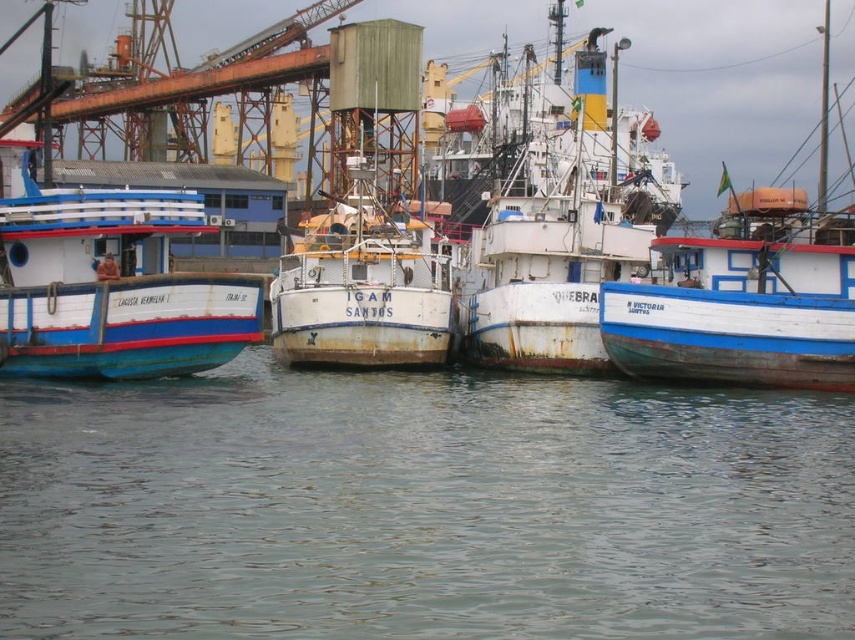
From the picture: Does clear water at center appear under blue painted wooden boat at left?

Yes.

Is clear water at center closer to the viewer compared to blue painted wooden boat at left?

Yes, clear water at center is in front of blue painted wooden boat at left.

Between point (777, 616) and point (109, 276), which one is positioned in front?

Point (777, 616)

Locate an element on the screen. This screenshot has width=855, height=640. clear water at center is located at coordinates (422, 508).

Does white weathered ship at center appear on the left side of blue painted wooden boat at left?

No, white weathered ship at center is not to the left of blue painted wooden boat at left.

Find the location of a particular element. Image resolution: width=855 pixels, height=640 pixels. white weathered ship at center is located at coordinates (565, 230).

Which is below, clear water at center or white weathered ship at center?

clear water at center is below.

Does clear water at center have a lesser height compared to white weathered ship at center?

Yes, clear water at center is shorter than white weathered ship at center.

Between point (234, 616) and point (584, 317), which one is positioned in front?

Positioned in front is point (234, 616).

Image resolution: width=855 pixels, height=640 pixels. I want to click on clear water at center, so click(x=422, y=508).